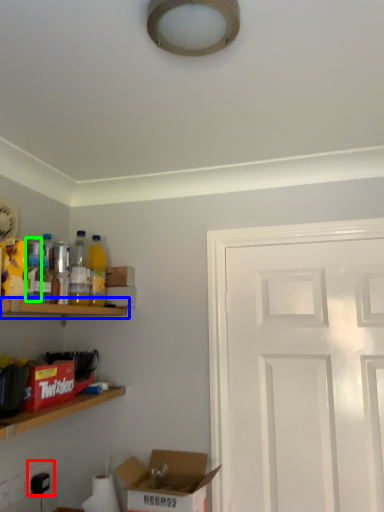
Question: Which object is positioned closest to electric outlet (highlighted by a red box)? Select from shelf (highlighted by a blue box) and bottle (highlighted by a green box).

Choices:
 (A) shelf
 (B) bottle

Answer: (A)